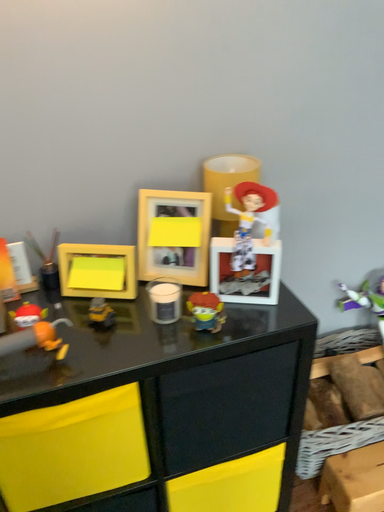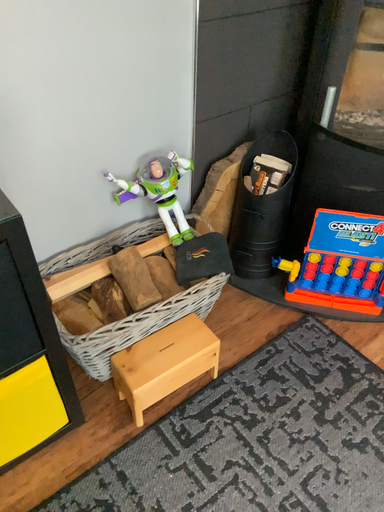
Question: How did the camera likely rotate when shooting the video?

Choices:
 (A) rotated left
 (B) rotated right

Answer: (B)